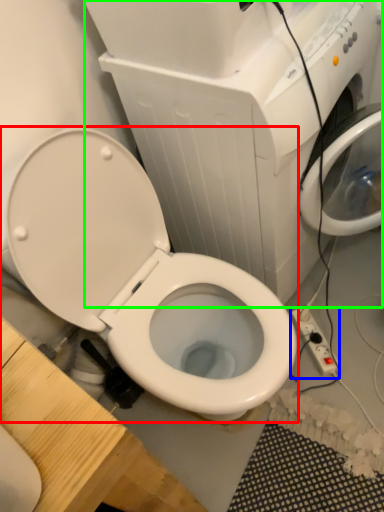
Question: Estimate the real-world distances between objects in this image. Which object is closer to toilet (highlighted by a red box), electric outlet (highlighted by a blue box) or appliance (highlighted by a green box)?

Choices:
 (A) electric outlet
 (B) appliance

Answer: (B)